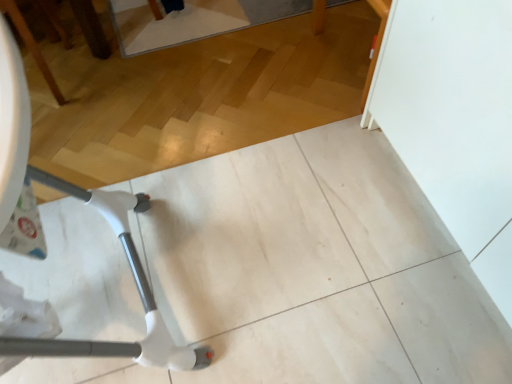
Where is `unoccupied region to the right of wooden table at upper left`? The width and height of the screenshot is (512, 384). unoccupied region to the right of wooden table at upper left is located at coordinates (111, 76).